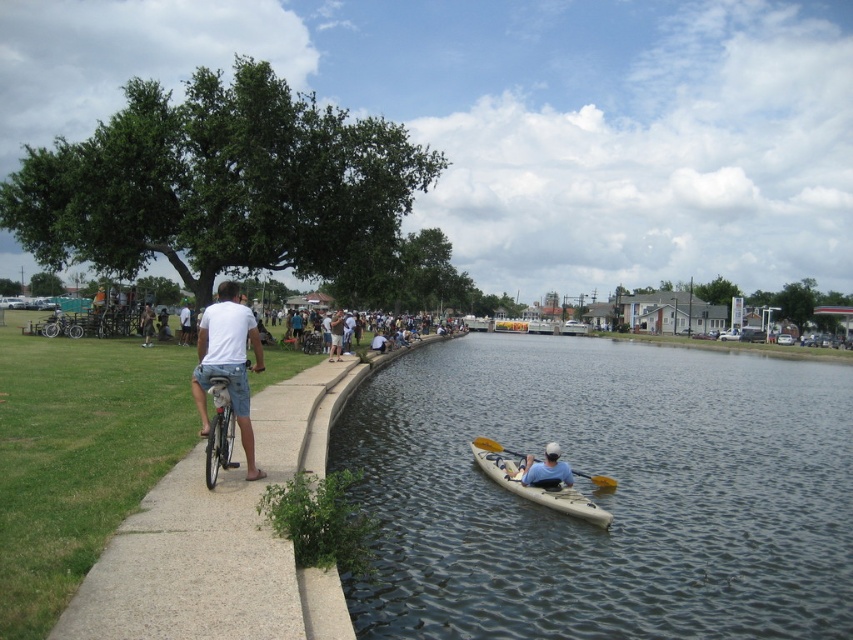
You are a photographer standing on the gray concrete sidewalk at left. You want to take a photo of the khaki shorts at left. Which direction should you move to get a better angle?

The gray concrete sidewalk at left is in front of khaki shorts at left, so you should move to the side to get a better angle.

You are a pedestrian walking along the paved pathway in the waterfront park. You see the clear water at center and the khaki shorts at left. Which object is closer to your current position?

The khaki shorts at left is closer to your current position because it is positioned on the left side of the clear water at center, which is further to the right.

You are a photographer trying to capture the entire gray concrete sidewalk at left and khaki shorts at left in a single frame. Given that your camera can only focus on objects within a 10 meter width, will both objects fit in the frame?

The gray concrete sidewalk at left is larger in size than khaki shorts at left, so it depends on their actual sizes. However, since the camera can focus on objects within a 10 meter width, and the sidewalk is part of the pathway mentioned in the scene, it is likely wider than 10 meters. Therefore, both objects might not fit within the frame.